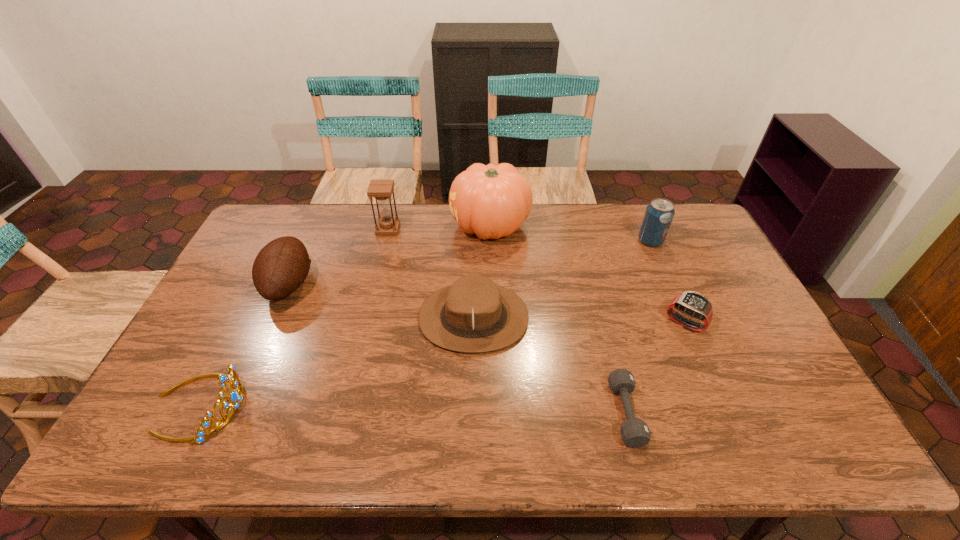
Find the location of `vacant point located between the tiara and the pumpkin`. vacant point located between the tiara and the pumpkin is located at coordinates (345, 315).

At what (x,y) coordinates should I click in order to perform the action: click on blank region between the sixth object from left to right and the watch. Please return your answer as a coordinate pair (x, y). This screenshot has width=960, height=540. Looking at the image, I should click on (655, 368).

At what (x,y) coordinates should I click in order to perform the action: click on empty location between the sixth object from right to left and the watch. Please return your answer as a coordinate pair (x, y). This screenshot has height=540, width=960. Looking at the image, I should click on (537, 276).

Locate which object is the seventh closest to the fedora. Please provide its 2D coordinates. Your answer should be formatted as a tuple, i.e. [(x, y)], where the tuple contains the x and y coordinates of a point satisfying the conditions above.

[(659, 214)]

I want to click on the second closest object to the sixth object from right to left, so click(x=282, y=265).

Locate an element on the screen. This screenshot has width=960, height=540. free point that satisfies the following two spatial constraints: 1. on the laces of the dumbbell; 2. on the right side of the football is located at coordinates (233, 413).

This screenshot has height=540, width=960. I want to click on free location that satisfies the following two spatial constraints: 1. on the back side of the watch; 2. on the laces of the football, so click(668, 285).

Image resolution: width=960 pixels, height=540 pixels. Identify the location of vacant space that satisfies the following two spatial constraints: 1. on the laces of the football; 2. on the left side of the watch. (273, 323).

The height and width of the screenshot is (540, 960). Find the location of `vacant area in the image that satisfies the following two spatial constraints: 1. on the carved face of the pumpkin; 2. on the front side of the sixth object from right to left`. vacant area in the image that satisfies the following two spatial constraints: 1. on the carved face of the pumpkin; 2. on the front side of the sixth object from right to left is located at coordinates (491, 229).

Locate an element on the screen. The image size is (960, 540). free space in the image that satisfies the following two spatial constraints: 1. on the front side of the watch; 2. on the front-facing side of the tiara is located at coordinates (720, 405).